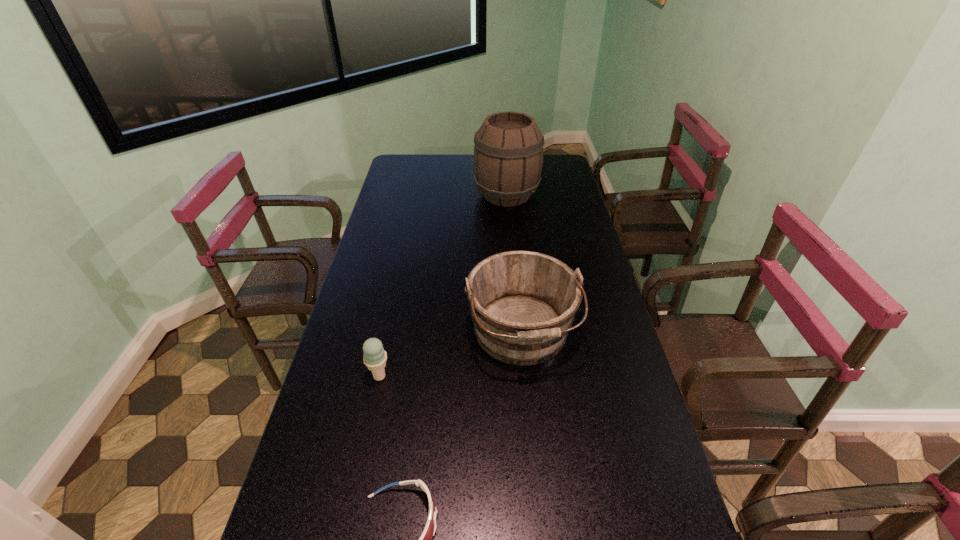
Locate an element on the screen. This screenshot has width=960, height=540. the tallest object is located at coordinates (508, 154).

Image resolution: width=960 pixels, height=540 pixels. In order to click on the farther wine bucket in this screenshot , I will do `click(508, 154)`.

Find the location of a particular element. The image size is (960, 540). the shorter wine bucket is located at coordinates (522, 303).

The image size is (960, 540). Find the location of `the second tallest object`. the second tallest object is located at coordinates (522, 303).

This screenshot has height=540, width=960. I want to click on the second shortest object, so click(375, 356).

The height and width of the screenshot is (540, 960). I want to click on free space located 0.180m on the front of the farther wine bucket, so click(511, 239).

At what (x,y) coordinates should I click in order to perform the action: click on free spot located on the front of the nearer wine bucket. Please return your answer as a coordinate pair (x, y). The width and height of the screenshot is (960, 540). Looking at the image, I should click on (535, 485).

Find the location of a particular element. vacant point located on the right of the third tallest object is located at coordinates (466, 376).

I want to click on object that is at the left edge, so click(x=375, y=356).

Find the location of a particular element. The image size is (960, 540). vacant region at the far edge of the desktop is located at coordinates (473, 162).